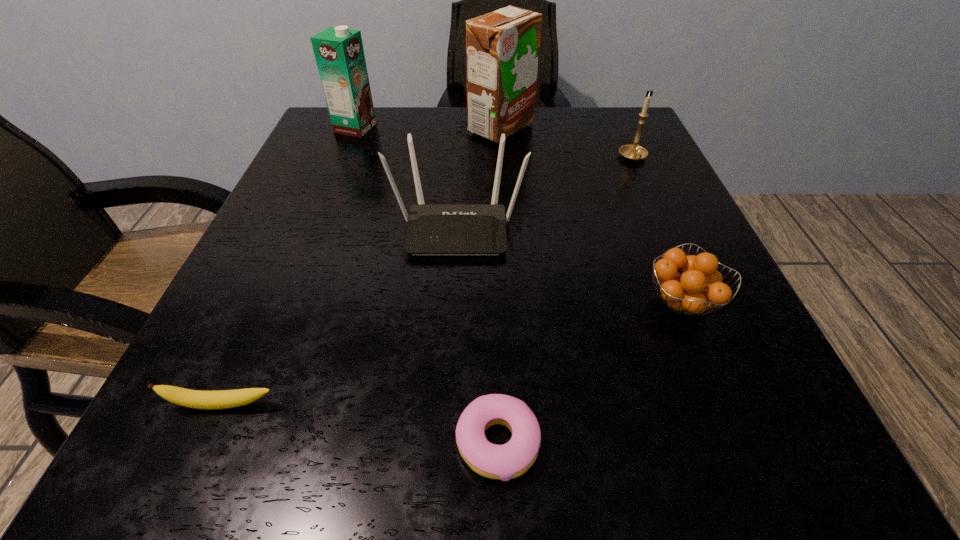
Where is `blank space at the right edge`? blank space at the right edge is located at coordinates (708, 371).

Identify the location of vacant space at the far right corner of the desktop. (571, 116).

Find the location of `empty space that is in between the third farthest object and the second shortest object`. empty space that is in between the third farthest object and the second shortest object is located at coordinates (428, 282).

You are a GUI agent. You are given a task and a screenshot of the screen. Output one action in this format:
    pyautogui.click(x=<x>, y=<y>)
    Task: Click on the free point between the fifth farthest object and the right carton
    This screenshot has height=540, width=960.
    Given the screenshot: What is the action you would take?
    pyautogui.click(x=591, y=215)

This screenshot has width=960, height=540. I want to click on empty space that is in between the candle holder and the sixth tallest object, so coord(428,282).

The height and width of the screenshot is (540, 960). Find the location of `vacant area that lies between the doughnut and the third farthest object`. vacant area that lies between the doughnut and the third farthest object is located at coordinates (565, 300).

Locate an element on the screen. This screenshot has height=540, width=960. free space between the shortest object and the third farthest object is located at coordinates (565, 300).

The width and height of the screenshot is (960, 540). In order to click on free space between the fourth farthest object and the left carton in this screenshot , I will do `click(406, 178)`.

Identify the location of vacant space that's between the doughnut and the fifth tallest object. The width and height of the screenshot is (960, 540). (589, 373).

At what (x,y) coordinates should I click in order to perform the action: click on empty space that is in between the fourth nearest object and the third shortest object. Please return your answer as a coordinate pair (x, y). This screenshot has height=540, width=960. Looking at the image, I should click on (569, 265).